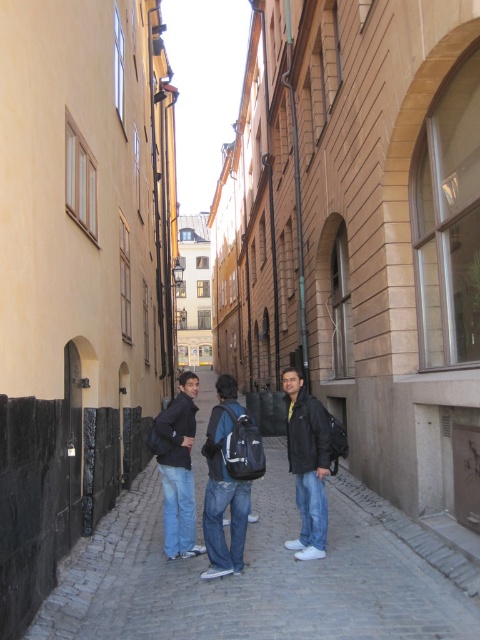
You are a tourist standing at the entrance of the narrow cobblestone street and see the black matte jacket at center. Based on its position, can you determine if the jacket is closer to the left or right side of the street?

The black matte jacket at center is located at point coordinates that place it near the center of the street, so it is neither closer to the left nor right side but positioned centrally.

You are a delivery person carrying a large box that is 1 meter wide. You are on a narrow cobblestone street and see the dark blue jeans at center and the black matte jacket at center. Can you pass between them without moving either object?

The dark blue jeans at center might be wider than the black matte jacket at center, so it is uncertain if there is enough space to pass through with a 1 meter wide box. Check the actual width between them first.